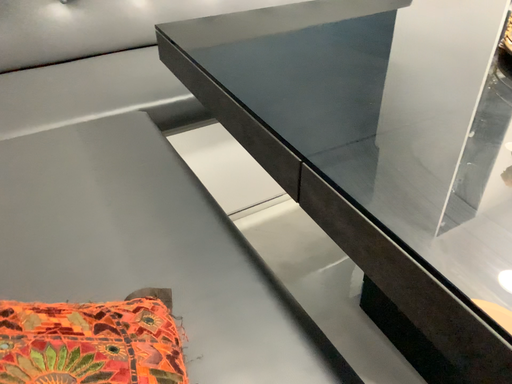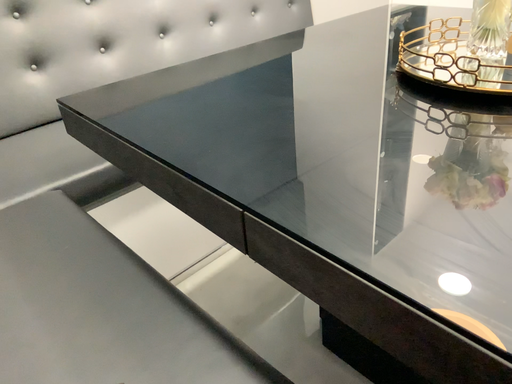
Question: How did the camera likely rotate when shooting the video?

Choices:
 (A) rotated downward
 (B) rotated upward

Answer: (B)